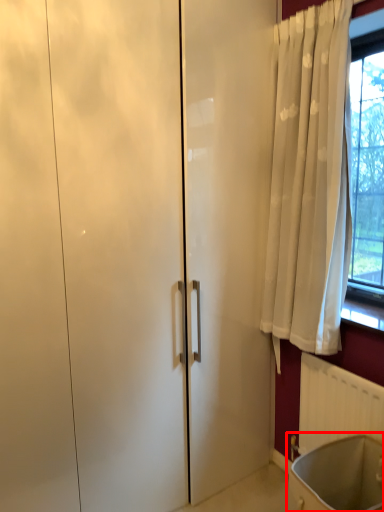
Question: In this image, where is bath (annotated by the red box) located relative to radiator?

Choices:
 (A) left
 (B) right

Answer: (A)